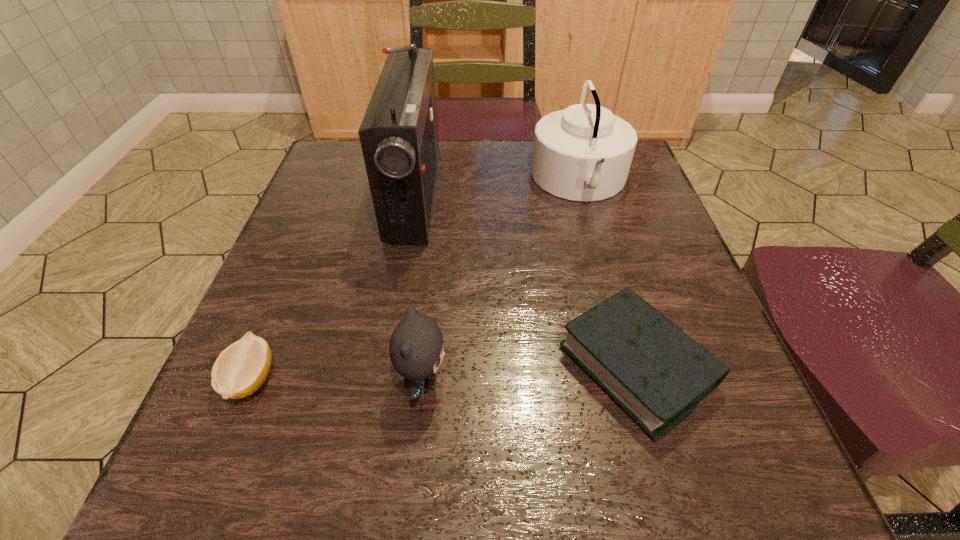
I want to click on the tallest object, so click(x=399, y=139).

Where is `the second tallest object`? the second tallest object is located at coordinates (583, 153).

Locate an element on the screen. This screenshot has height=540, width=960. the third tallest object is located at coordinates (416, 346).

Where is `Bible`? Bible is located at coordinates (654, 371).

The width and height of the screenshot is (960, 540). What are the coordinates of `lemon` in the screenshot? It's located at click(x=241, y=368).

This screenshot has height=540, width=960. What are the coordinates of `blank area located on the front-facing side of the radio receiver` in the screenshot? It's located at (525, 193).

Where is `free space located on the spout of the second tallest object`? free space located on the spout of the second tallest object is located at coordinates [x=383, y=181].

What are the coordinates of `blank area located on the spout of the second tallest object` in the screenshot? It's located at (511, 181).

The width and height of the screenshot is (960, 540). I want to click on vacant space located on the spout of the second tallest object, so click(399, 181).

The height and width of the screenshot is (540, 960). In order to click on free space located 0.260m on the front-facing side of the kitten in this screenshot , I will do `click(620, 381)`.